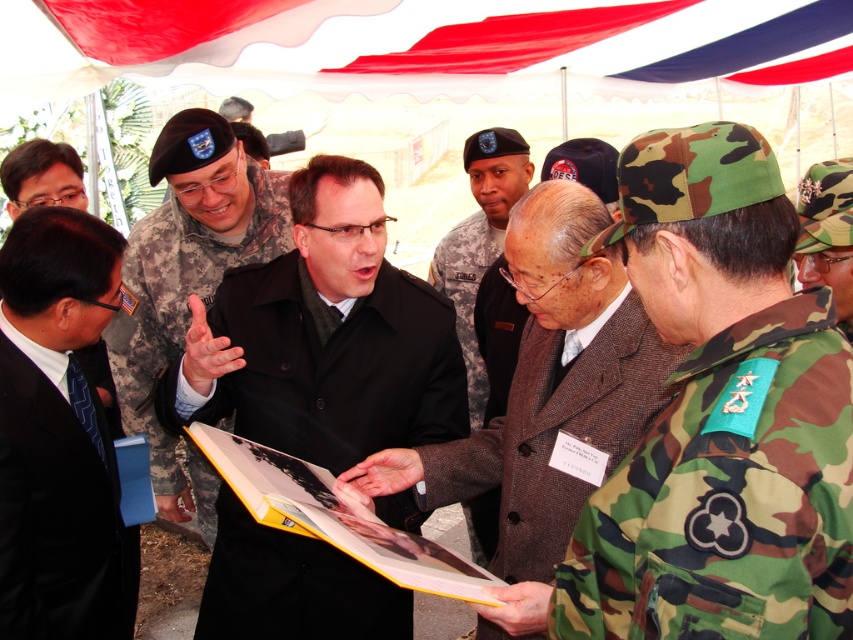
You are a photographer at the event and want to capture a photo of both the brown woolen coat at center and the brown wool coat at center. Which one is on the right side when viewed from the front?

The brown woolen coat at center is positioned on the right side of the brown wool coat at center.

You are a photographer at the event and want to take a photo of the brown wool coat at center and the camo fabric hat at right. Which object is positioned closer to the camera?

The brown wool coat at center is closer to the camera because the camo fabric hat at right is behind it.

You are organizing a military event and need to ensure that the coat and hat provided to participants are appropriately sized. Given the brown wool coat at center and the camo fabric hat at right, which item would require a larger storage space when packing?

The brown wool coat at center requires a larger storage space when packing because it has a larger size compared to the camo fabric hat at right.